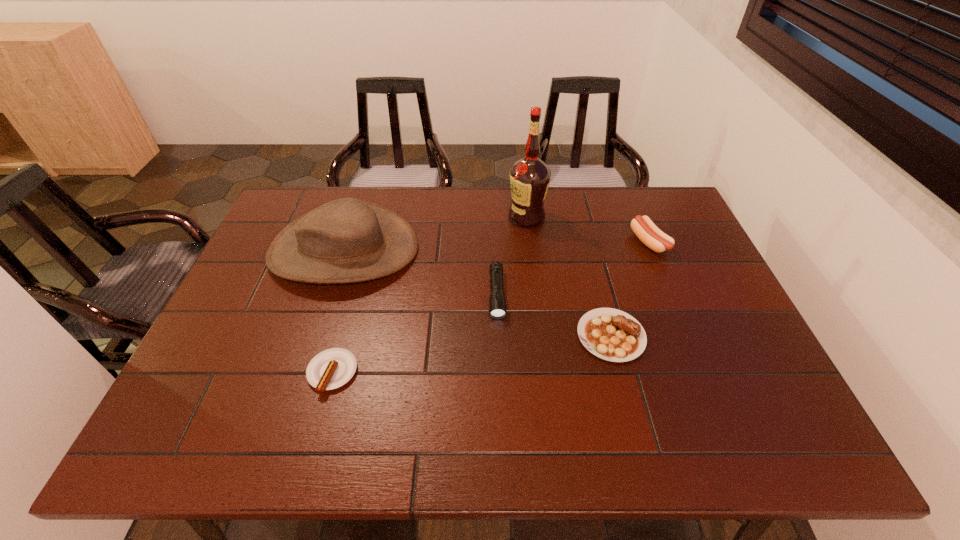
You are a GUI agent. You are given a task and a screenshot of the screen. Output one action in this format:
    pyautogui.click(x=<x>, y=<y>)
    Task: Click on the sausage located in the far edge section of the desktop
    The height and width of the screenshot is (540, 960).
    Given the screenshot: What is the action you would take?
    pyautogui.click(x=648, y=233)

You are a GUI agent. You are given a task and a screenshot of the screen. Output one action in this format:
    pyautogui.click(x=<x>, y=<y>)
    Task: Click on the object that is at the left edge
    
    Given the screenshot: What is the action you would take?
    pyautogui.click(x=347, y=240)

The width and height of the screenshot is (960, 540). In order to click on object that is at the right edge in this screenshot , I will do `click(648, 233)`.

This screenshot has width=960, height=540. I want to click on object that is at the far left corner, so click(x=347, y=240).

At what (x,y) coordinates should I click in order to perform the action: click on object located at the far right corner. Please return your answer as a coordinate pair (x, y). Looking at the image, I should click on (648, 233).

In the image, there is a desktop. Where is `free region at the far edge`? The height and width of the screenshot is (540, 960). free region at the far edge is located at coordinates (609, 194).

Find the location of a particular element. The height and width of the screenshot is (540, 960). blank space at the near edge is located at coordinates pyautogui.click(x=533, y=428).

The image size is (960, 540). Find the location of `vacant space at the left edge of the desktop`. vacant space at the left edge of the desktop is located at coordinates (276, 326).

The image size is (960, 540). Identify the location of free space at the right edge of the desktop. (681, 250).

Locate an element on the screen. This screenshot has width=960, height=540. vacant space at the far right corner is located at coordinates (653, 187).